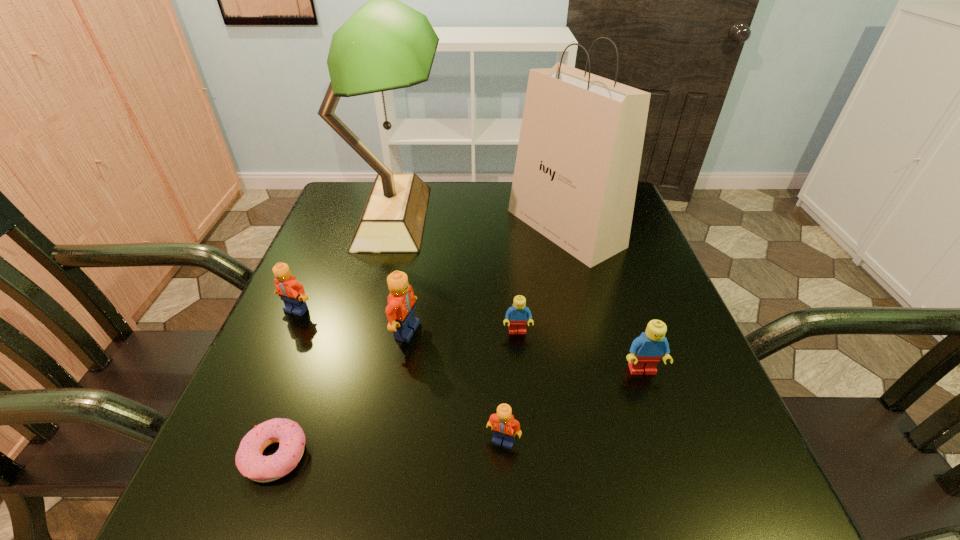
Locate an element on the screen. table lamp is located at coordinates (385, 45).

The height and width of the screenshot is (540, 960). In order to click on shopping bag in this screenshot , I will do `click(579, 153)`.

Image resolution: width=960 pixels, height=540 pixels. What are the coordinates of `the tallest Lego` in the screenshot? It's located at (400, 310).

I want to click on the second Lego from left to right, so click(x=400, y=310).

In order to click on the leftmost Lego in this screenshot , I will do pyautogui.click(x=292, y=293).

This screenshot has width=960, height=540. Find the location of `the leftmost orange Lego`. the leftmost orange Lego is located at coordinates (292, 293).

This screenshot has width=960, height=540. I want to click on the rightmost Lego, so click(646, 350).

Image resolution: width=960 pixels, height=540 pixels. Find the location of `the bigger blue Lego`. the bigger blue Lego is located at coordinates (646, 350).

The width and height of the screenshot is (960, 540). Find the location of `the nearest Lego`. the nearest Lego is located at coordinates (503, 424).

Where is `the rightmost orange Lego`? This screenshot has width=960, height=540. the rightmost orange Lego is located at coordinates (503, 424).